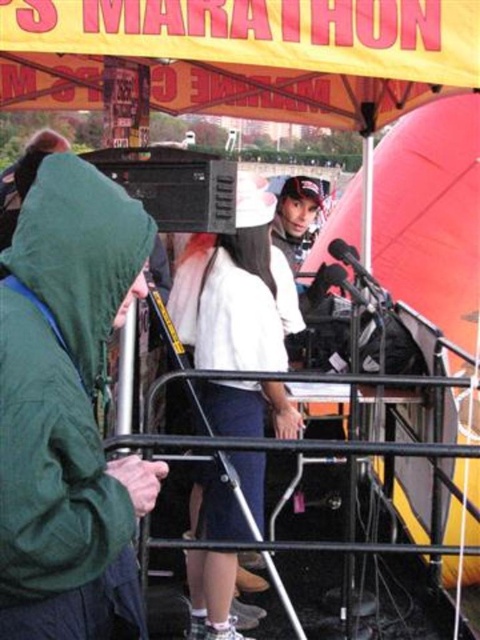
You are a participant in the marathon and need to hand over your race number to the volunteer. The volunteer is wearing the white fabric shirt at center. However, there is a person in the green matte jacket at left blocking your view. Can you see the volunteer clearly?

The green matte jacket at left is positioned over white fabric shirt at center, so the volunteer wearing the white fabric shirt at center is partially or fully obscured by the person in the green matte jacket at left. You cannot see the volunteer clearly.

You are a photographer at the marathon event. You need to capture a photo of both the green matte jacket at left and the white fabric shirt at center. Which object should you adjust your camera angle to focus on first to ensure both are in frame?

The green matte jacket at left is shorter than the white fabric shirt at center, so you should focus on the white fabric shirt at center first to ensure both are visible in the frame.